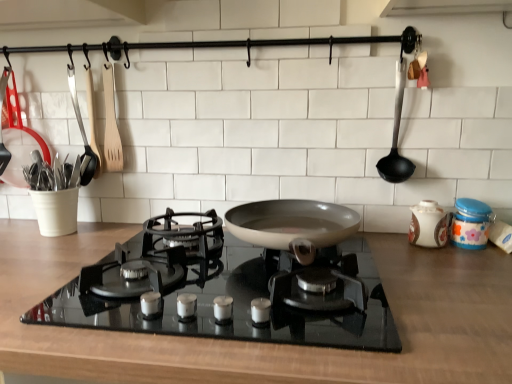
Question: Can you confirm if white plastic utensil holder at left, the 1th kitchen appliance from the left, is positioned to the left of blue glossy jar at right, marked as the 1th kitchen appliance in a right-to-left arrangement?

Choices:
 (A) no
 (B) yes

Answer: (B)

Question: From the image's perspective, is white plastic utensil holder at left, the 1th kitchen appliance from the left, above blue glossy jar at right, the 5th kitchen appliance from the left?

Choices:
 (A) no
 (B) yes

Answer: (B)

Question: Can you confirm if white plastic utensil holder at left, the 1th kitchen appliance from the left, is bigger than blue glossy jar at right, marked as the 1th kitchen appliance in a right-to-left arrangement?

Choices:
 (A) no
 (B) yes

Answer: (B)

Question: Can you confirm if white plastic utensil holder at left, placed as the fifth kitchen appliance when sorted from right to left, is smaller than blue glossy jar at right, the 5th kitchen appliance from the left?

Choices:
 (A) yes
 (B) no

Answer: (B)

Question: Does white plastic utensil holder at left, placed as the fifth kitchen appliance when sorted from right to left, come behind blue glossy jar at right, the 5th kitchen appliance from the left?

Choices:
 (A) no
 (B) yes

Answer: (B)

Question: From a real-world perspective, is black glass gas stove at center positioned above or below blue glossy jar at right, marked as the 1th kitchen appliance in a right-to-left arrangement?

Choices:
 (A) above
 (B) below

Answer: (B)

Question: Based on their sizes in the image, would you say black glass gas stove at center is bigger or smaller than blue glossy jar at right, marked as the 1th kitchen appliance in a right-to-left arrangement?

Choices:
 (A) big
 (B) small

Answer: (A)

Question: In the image, is black glass gas stove at center positioned in front of or behind blue glossy jar at right, marked as the 1th kitchen appliance in a right-to-left arrangement?

Choices:
 (A) front
 (B) behind

Answer: (A)

Question: Considering the relative positions of black glass gas stove at center and blue glossy jar at right, marked as the 1th kitchen appliance in a right-to-left arrangement, in the image provided, is black glass gas stove at center to the left or to the right of blue glossy jar at right, marked as the 1th kitchen appliance in a right-to-left arrangement,?

Choices:
 (A) right
 (B) left

Answer: (B)

Question: Is black glass gas stove at center inside the boundaries of porcelain jar at right, the fourth kitchen appliance when ordered from left to right, or outside?

Choices:
 (A) inside
 (B) outside

Answer: (B)

Question: Considering the positions of black glass gas stove at center and porcelain jar at right, which is counted as the 2th kitchen appliance, starting from the right, in the image, is black glass gas stove at center wider or thinner than porcelain jar at right, which is counted as the 2th kitchen appliance, starting from the right,?

Choices:
 (A) wide
 (B) thin

Answer: (A)

Question: Is black glass gas stove at center in front of or behind porcelain jar at right, which is counted as the 2th kitchen appliance, starting from the right, in the image?

Choices:
 (A) front
 (B) behind

Answer: (A)

Question: In terms of height, does black glass gas stove at center look taller or shorter compared to porcelain jar at right, which is counted as the 2th kitchen appliance, starting from the right?

Choices:
 (A) tall
 (B) short

Answer: (B)

Question: Looking at the image, does black plastic ladle at right seem bigger or smaller compared to white plastic utensil holder at left, placed as the fifth kitchen appliance when sorted from right to left?

Choices:
 (A) small
 (B) big

Answer: (A)

Question: From a real-world perspective, is black plastic ladle at right physically located above or below white plastic utensil holder at left, the 1th kitchen appliance from the left?

Choices:
 (A) below
 (B) above

Answer: (B)